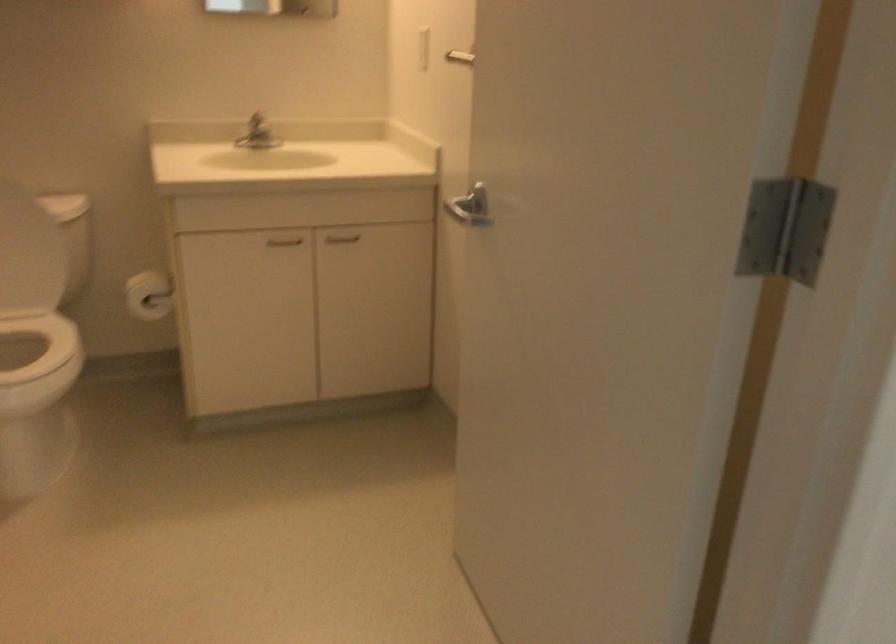
Locate an element on the screen. metal towel rack is located at coordinates pos(459,57).